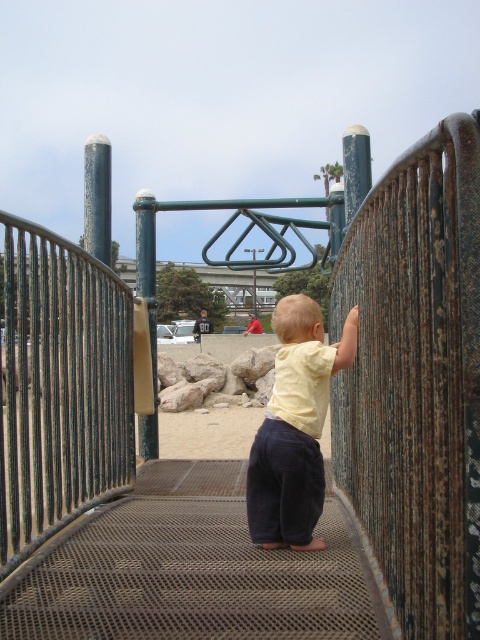
Question: Which point appears closest to the camera in this image?

Choices:
 (A) (283, 541)
 (B) (131, 529)

Answer: (A)

Question: Which point is farther to the camera?

Choices:
 (A) (294, 541)
 (B) (244, 472)

Answer: (B)

Question: Does rustic metal stairs at center have a greater width compared to yellow matte shirt at center?

Choices:
 (A) no
 (B) yes

Answer: (B)

Question: Can you confirm if rustic metal stairs at center is smaller than yellow matte shirt at center?

Choices:
 (A) no
 (B) yes

Answer: (A)

Question: Among these points, which one is farthest from the camera?

Choices:
 (A) (76, 538)
 (B) (273, 408)

Answer: (A)

Question: Is rustic metal stairs at center smaller than yellow matte shirt at center?

Choices:
 (A) yes
 (B) no

Answer: (B)